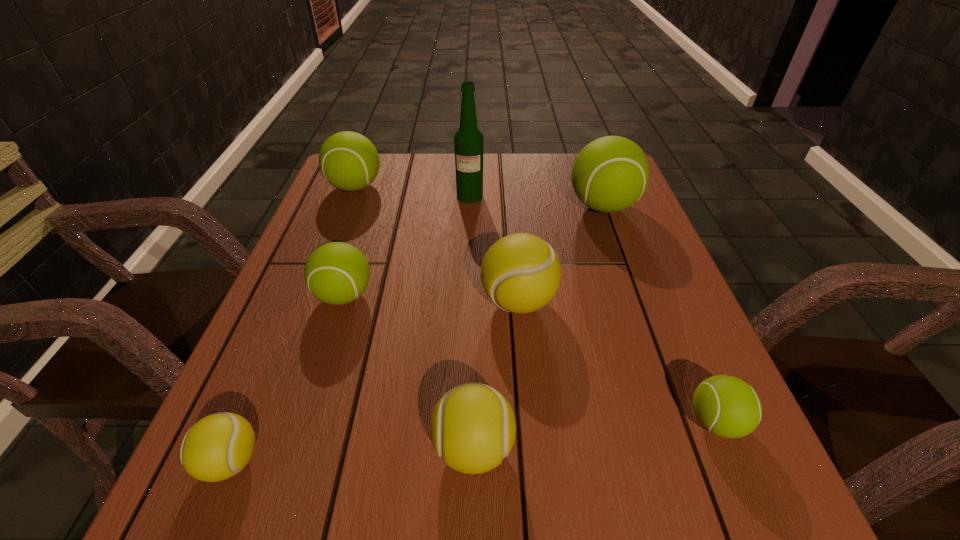
At what (x,y) coordinates should I click in order to perform the action: click on free point located on the label of the beer bottle. Please return your answer as a coordinate pair (x, y). Looking at the image, I should click on (469, 222).

Locate an element on the screen. vacant space situated 0.210m on the front of the seventh shortest object is located at coordinates (633, 289).

The width and height of the screenshot is (960, 540). Identify the location of free space located on the front of the farthest yellow tennis ball. tap(524, 366).

You are a GUI agent. You are given a task and a screenshot of the screen. Output one action in this format:
    pyautogui.click(x=<x>, y=<y>)
    Task: Click on the vacant space located on the front of the third smallest green tennis ball
    The width and height of the screenshot is (960, 540).
    Given the screenshot: What is the action you would take?
    pyautogui.click(x=335, y=239)

What are the coordinates of `vacant space located 0.190m on the back of the third farthest green tennis ball` in the screenshot? It's located at (368, 222).

The height and width of the screenshot is (540, 960). I want to click on vacant space located 0.150m on the right of the second biggest yellow tennis ball, so click(615, 448).

Identify the location of free space located 0.290m on the left of the nearest green tennis ball. (500, 422).

I want to click on free space located on the back of the leftmost yellow tennis ball, so click(x=308, y=276).

You are a GUI agent. You are given a task and a screenshot of the screen. Output one action in this format:
    pyautogui.click(x=<x>, y=<y>)
    Task: Click on the beer bottle situated at the far edge
    
    Given the screenshot: What is the action you would take?
    pyautogui.click(x=468, y=140)

Find the location of a particular element. The image size is (960, 540). object located at the far left corner is located at coordinates (349, 161).